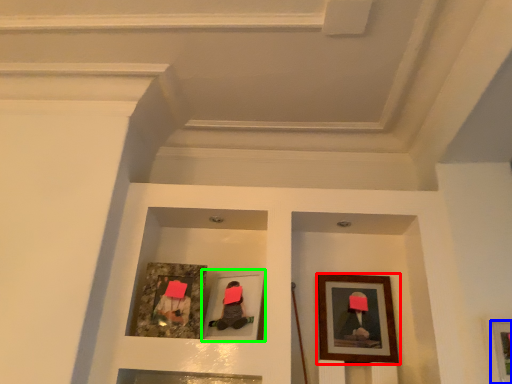
Question: Considering the real-world distances, which object is closest to picture frame (highlighted by a red box)? picture frame (highlighted by a blue box) or picture frame (highlighted by a green box).

Choices:
 (A) picture frame
 (B) picture frame

Answer: (B)